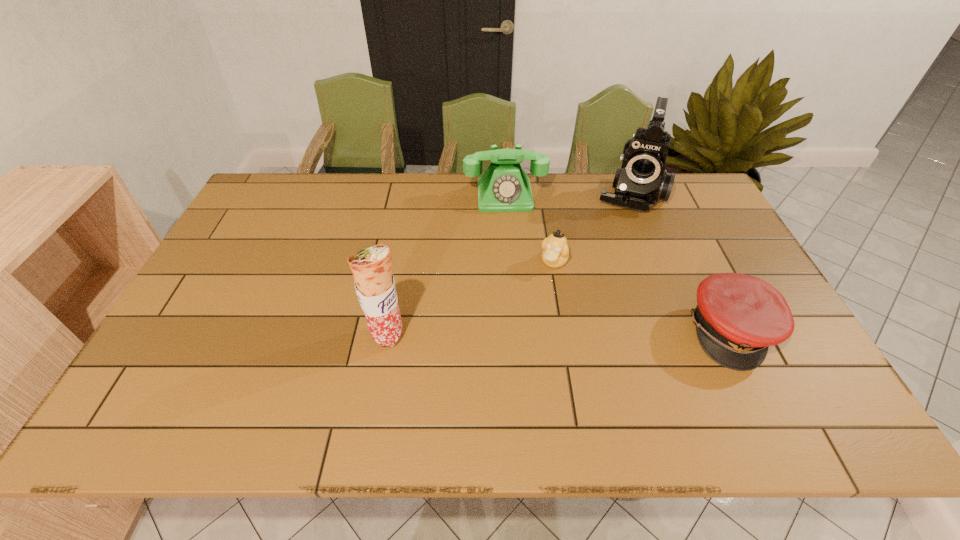
Locate an element on the screen. vacant position in the image that satisfies the following two spatial constraints: 1. on the front side of the duckling; 2. on the right side of the third tallest object is located at coordinates (510, 262).